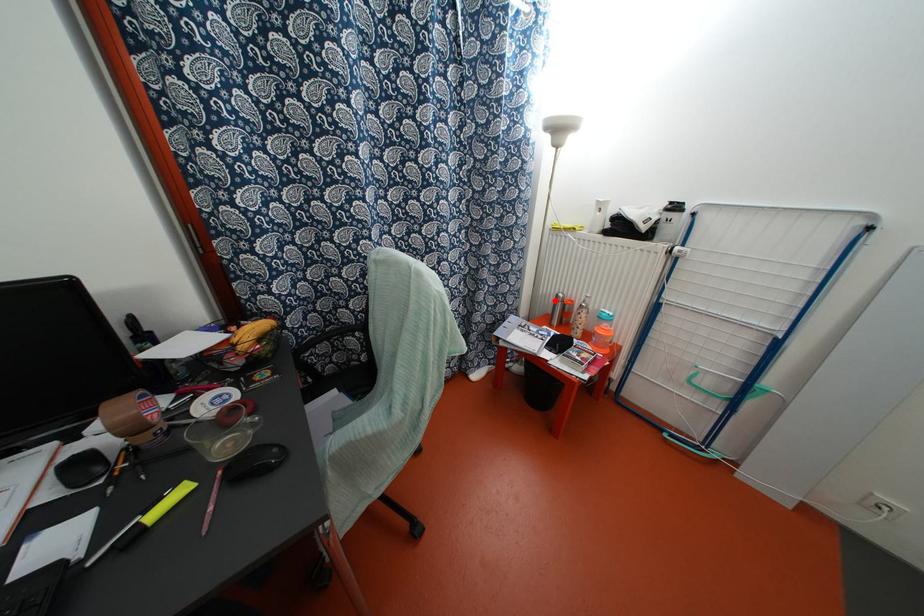
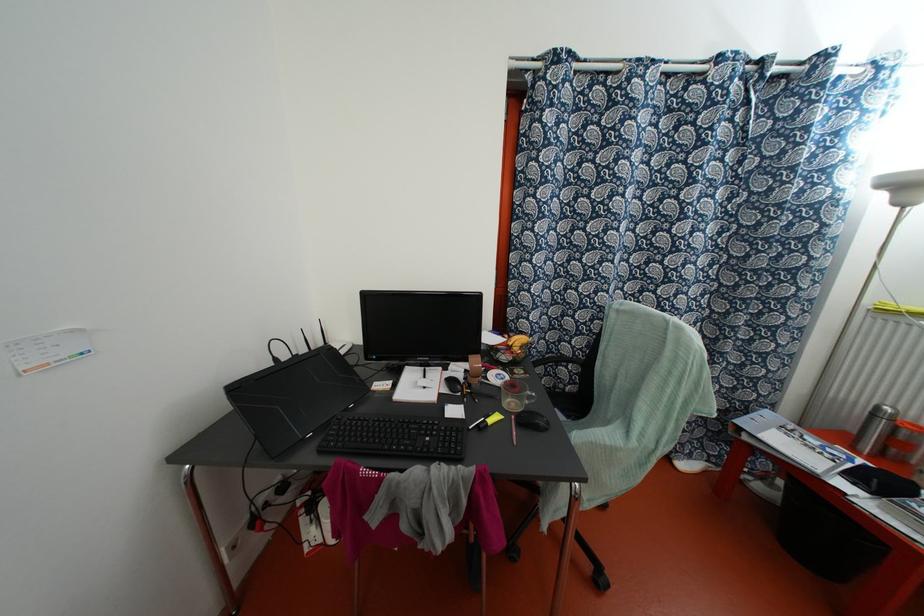
Question: I am providing you with two images of the same scene from different viewpoints. A red point is marked on the first image. At the location where the point appears in image 1, is it still visible in image 2?

Choices:
 (A) Yes
 (B) No

Answer: (A)